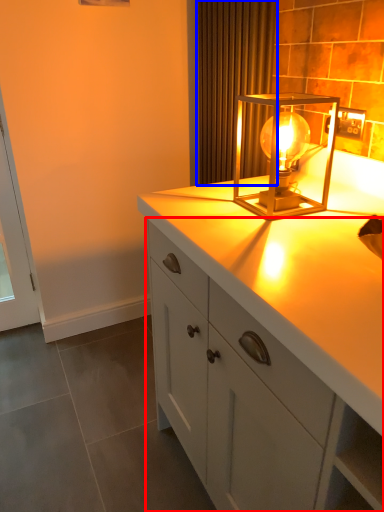
Question: Which object is closer to the camera taking this photo, cabinetry (highlighted by a red box) or curtain (highlighted by a blue box)?

Choices:
 (A) cabinetry
 (B) curtain

Answer: (A)